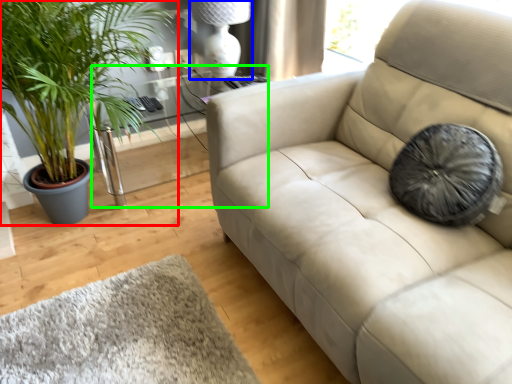
Question: Considering the real-world distances, which object is closest to houseplant (highlighted by a red box)? lamp (highlighted by a blue box) or table (highlighted by a green box).

Choices:
 (A) lamp
 (B) table

Answer: (B)